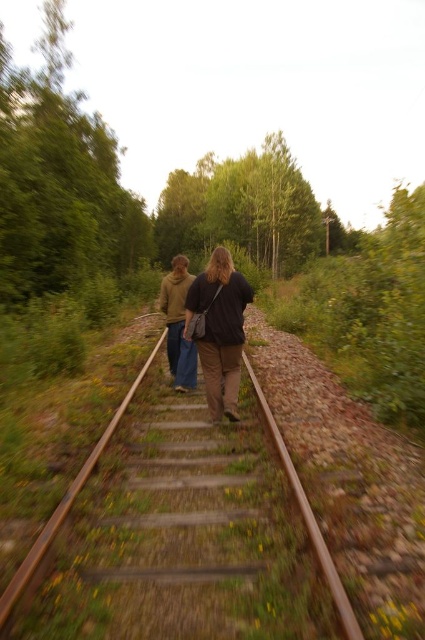
Question: Is rusty metal train track at center smaller than brown cotton hoodie at center?

Choices:
 (A) no
 (B) yes

Answer: (B)

Question: Which object is closer to the camera taking this photo?

Choices:
 (A) rusty metal train track at center
 (B) brown cotton hoodie at center

Answer: (A)

Question: Which object is the farthest from the brown cotton hoodie at center?

Choices:
 (A) dark brown leather jacket at center
 (B) rusty metal train track at center

Answer: (B)

Question: Which of the following is the farthest from the observer?

Choices:
 (A) brown cotton hoodie at center
 (B) rusty metal train track at center

Answer: (A)

Question: Can you confirm if dark brown leather jacket at center is thinner than brown cotton hoodie at center?

Choices:
 (A) no
 (B) yes

Answer: (B)

Question: Can you confirm if rusty metal train track at center is smaller than dark brown leather jacket at center?

Choices:
 (A) yes
 (B) no

Answer: (B)